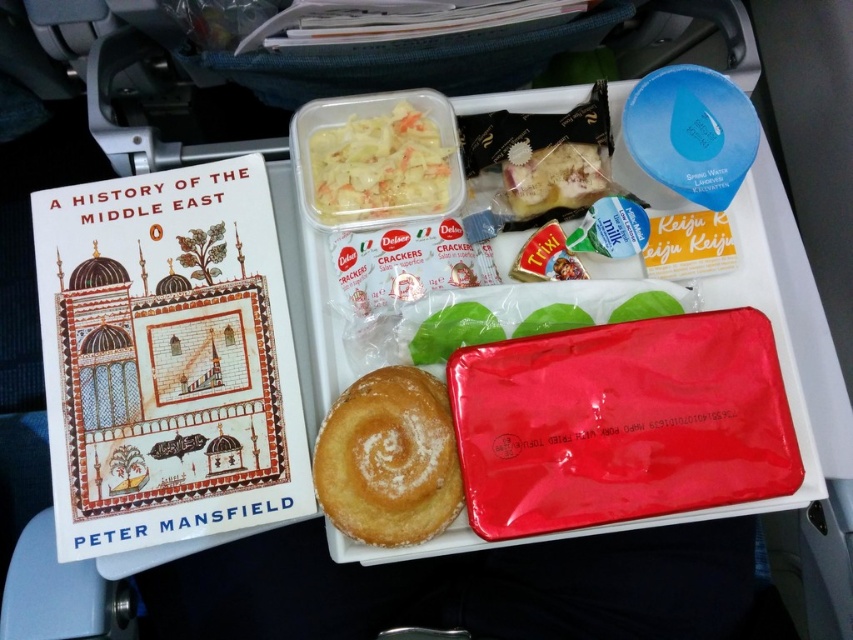
You are a flight attendant placing a yellow cheese at center on a matte plastic tray at center. The airline requires that the cheese must be placed exactly 6 inches away from the tray edge. Can you confirm if the current placement meets the requirement?

The matte plastic tray at center is 6.17 inches away from yellow cheese at center. Since the required distance is 6 inches, the current placement is slightly over the required distance by 0.17 inches and does not meet the airline requirement.